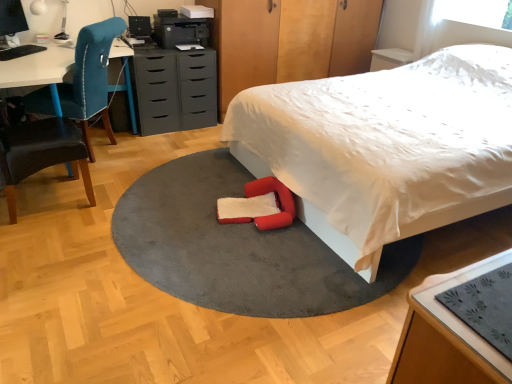
This screenshot has width=512, height=384. What are the coordinates of `free spot in front of red plush bean bag chair at lower center` in the screenshot? It's located at (249, 257).